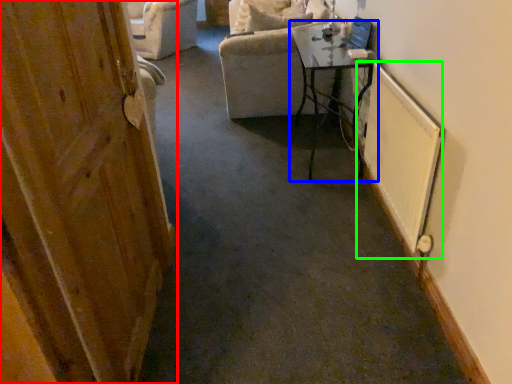
Question: Considering the real-world distances, which object is farthest from door (highlighted by a red box)? table (highlighted by a blue box) or radiator (highlighted by a green box)?

Choices:
 (A) table
 (B) radiator

Answer: (A)